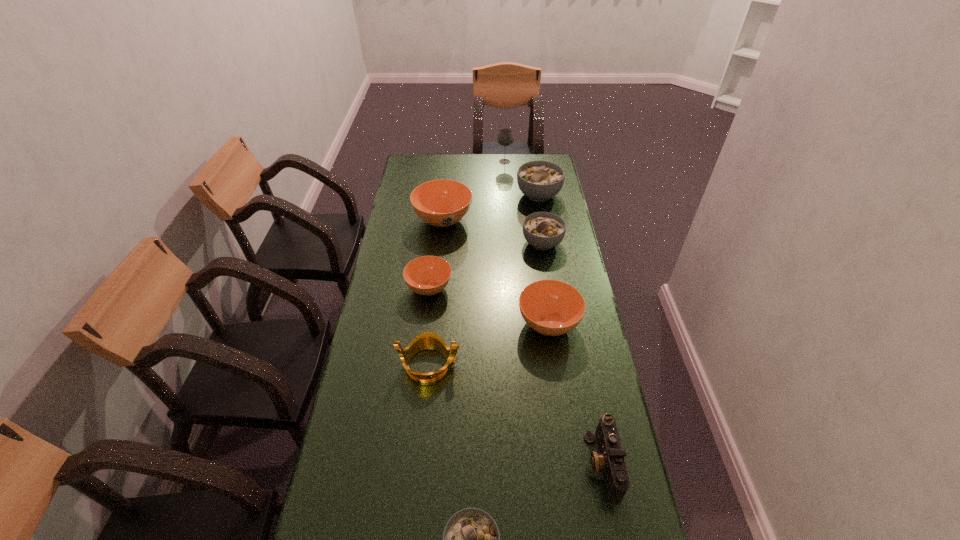
What are the coordinates of `vacant area situated on the left of the biggest white soup bowl` in the screenshot? It's located at (442, 195).

The image size is (960, 540). I want to click on vacant space positioned on the back of the biggest peach soup bowl, so click(x=449, y=159).

What are the coordinates of `vacant space located 0.380m at the front emblem of the gold tiara` in the screenshot? It's located at (585, 364).

You are a GUI agent. You are given a task and a screenshot of the screen. Output one action in this format:
    pyautogui.click(x=<x>, y=<y>)
    Task: Click on the vacant region located on the back of the second smallest peach soup bowl
    
    Given the screenshot: What is the action you would take?
    pyautogui.click(x=543, y=286)

This screenshot has height=540, width=960. Identify the location of vacant space situated 0.250m on the back of the second farthest white soup bowl. (535, 197).

Where is `blank space located on the front-facing side of the second nearest object`? This screenshot has width=960, height=540. blank space located on the front-facing side of the second nearest object is located at coordinates (506, 463).

I want to click on vacant point located on the front-facing side of the second nearest object, so click(494, 463).

Identify the location of vacant region located 0.190m on the front-facing side of the second nearest object. (514, 463).

Identify the location of vacant space located 0.250m on the back of the smallest peach soup bowl. The height and width of the screenshot is (540, 960). [x=436, y=231].

The height and width of the screenshot is (540, 960). Identify the location of object positioned at the far edge. (505, 137).